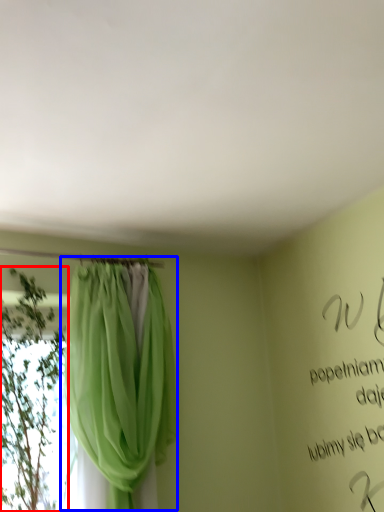
Question: Which object is further to the camera taking this photo, plant (highlighted by a red box) or curtain (highlighted by a blue box)?

Choices:
 (A) plant
 (B) curtain

Answer: (A)